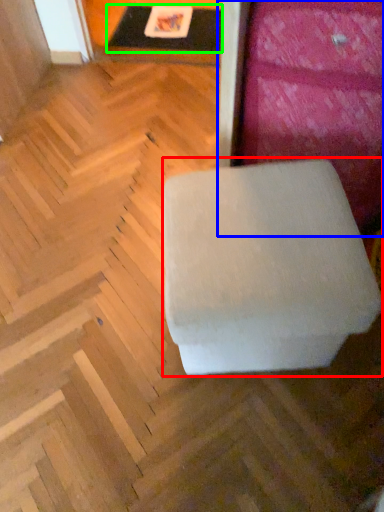
Question: Estimate the real-world distances between objects in this image. Which object is closer to furniture (highlighted by a red box), furniture (highlighted by a blue box) or table (highlighted by a green box)?

Choices:
 (A) furniture
 (B) table

Answer: (A)